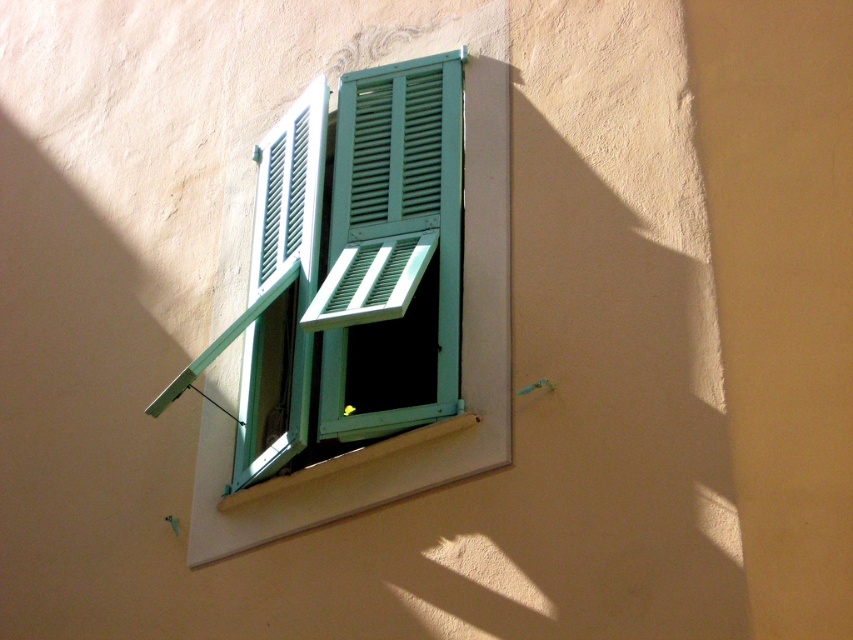
Question: Can you confirm if teal painted wood at center is positioned to the left of white painted wood at lower center?

Choices:
 (A) no
 (B) yes

Answer: (A)

Question: Which point is farther to the camera?

Choices:
 (A) teal painted wood at center
 (B) white painted wood at lower center

Answer: (A)

Question: Is teal painted wood at center further to camera compared to white painted wood at lower center?

Choices:
 (A) yes
 (B) no

Answer: (A)

Question: Among these points, which one is farthest from the camera?

Choices:
 (A) (369, 451)
 (B) (476, 308)

Answer: (B)

Question: Is teal painted wood at center below white painted wood at lower center?

Choices:
 (A) yes
 (B) no

Answer: (B)